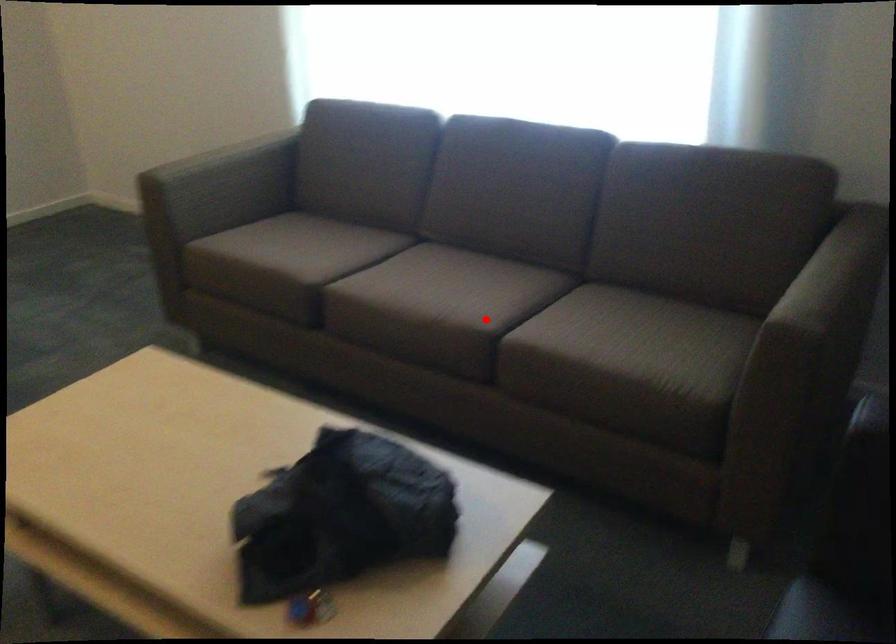
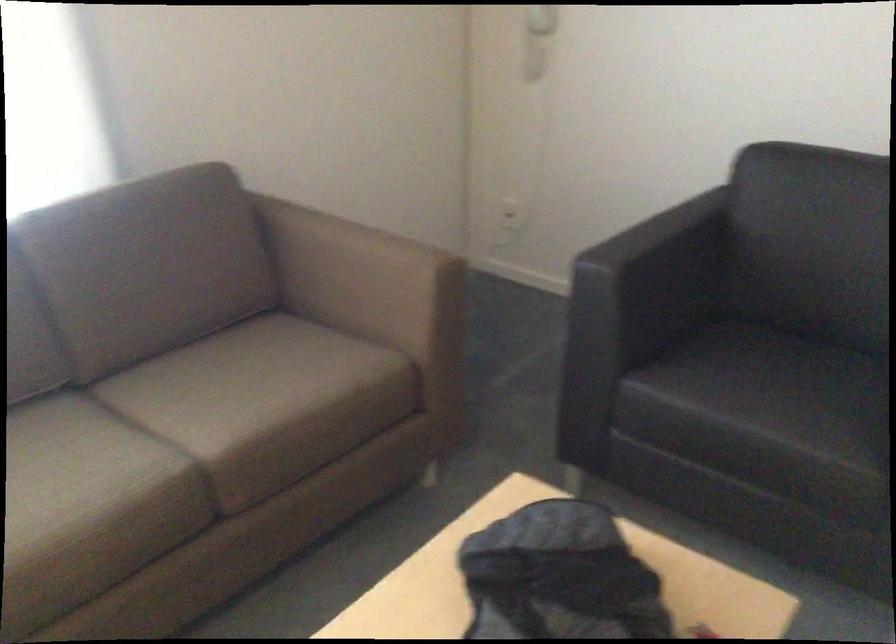
Find the pixel in the second image that matches the highlighted location in the first image.

(179, 451)